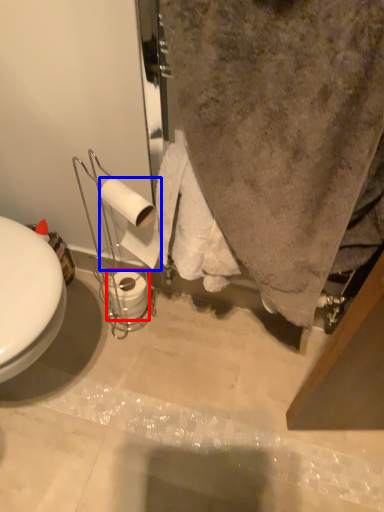
Question: Among these objects, which one is nearest to the camera, toilet paper (highlighted by a red box) or toilet paper (highlighted by a blue box)?

Choices:
 (A) toilet paper
 (B) toilet paper

Answer: (B)